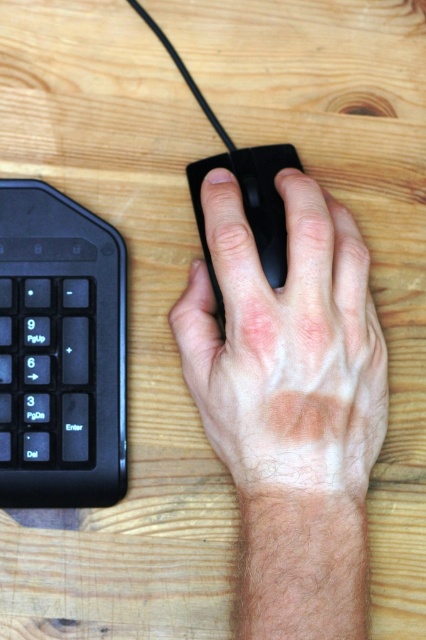
You are setting up a workspace and want to place the smooth matte black mouse at center and the black matte keyboard at lower left on a desk. If the desk has a space that can only accommodate items up to the size of the keyboard, will the mouse fit?

The smooth matte black mouse at center is larger in width than the black matte keyboard at lower left, so it will not fit in the space allocated for the keyboard.

You are setting up a workspace and have two mice to choose from. The smooth matte black mouse at center and the black matte mouse at center. Which one should you pick if you want the larger one?

The smooth matte black mouse at center is bigger than the black matte mouse at center, so you should pick the smooth matte black mouse at center.